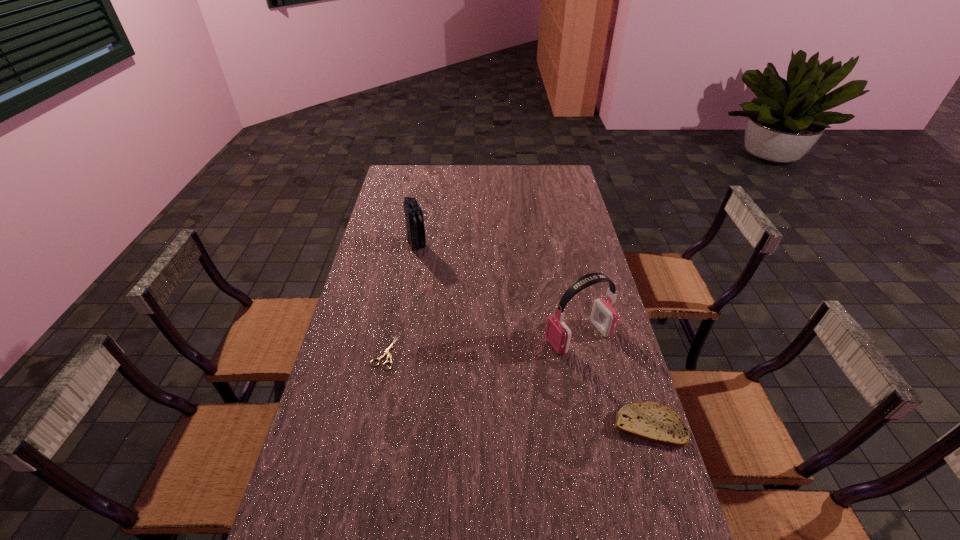
At what (x,y) coordinates should I click in order to perform the action: click on free space located with the zip open on the clutch bag. Please return your answer as a coordinate pair (x, y). Looking at the image, I should click on (437, 286).

This screenshot has width=960, height=540. I want to click on free space located 0.150m on the outer surface of the tallest object, so click(506, 362).

The image size is (960, 540). In order to click on blank area located 0.360m on the outer surface of the tallest object in this screenshot , I will do [442, 387].

Image resolution: width=960 pixels, height=540 pixels. Identify the location of free spot located on the outer surface of the tallest object. click(x=464, y=378).

Image resolution: width=960 pixels, height=540 pixels. Find the location of `shears present at the left edge`. shears present at the left edge is located at coordinates (387, 352).

Where is `clutch bag that is at the left edge`? The height and width of the screenshot is (540, 960). clutch bag that is at the left edge is located at coordinates (416, 238).

Locate an element on the screen. Image resolution: width=960 pixels, height=540 pixels. pita bread that is at the right edge is located at coordinates (x=648, y=421).

The width and height of the screenshot is (960, 540). Find the location of `earphone positioned at the right edge`. earphone positioned at the right edge is located at coordinates (604, 316).

The image size is (960, 540). What are the coordinates of `free location at the far edge of the desktop` in the screenshot? It's located at (487, 165).

In the image, there is a desktop. Where is `vacant space at the left edge`? This screenshot has height=540, width=960. vacant space at the left edge is located at coordinates (375, 352).